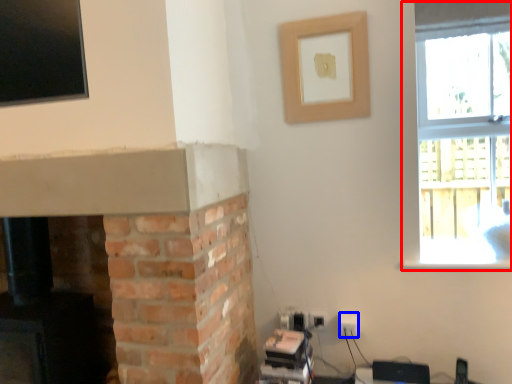
Question: Which object appears farthest to the camera in this image, window (highlighted by a red box) or electric outlet (highlighted by a blue box)?

Choices:
 (A) window
 (B) electric outlet

Answer: (B)